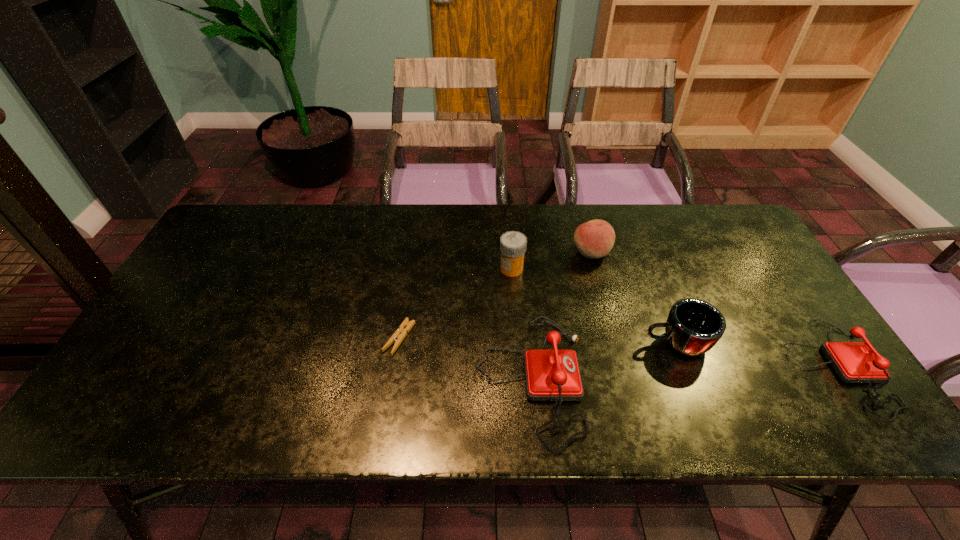
The width and height of the screenshot is (960, 540). Identify the location of vacant space located on the label side of the medicine. (482, 269).

Locate an element on the screen. The width and height of the screenshot is (960, 540). free location located on the label side of the medicine is located at coordinates (363, 269).

You are a GUI agent. You are given a task and a screenshot of the screen. Output one action in this format:
    pyautogui.click(x=<x>, y=<y>)
    Task: Click on the vacant area situated on the label side of the medicine
    This screenshot has height=540, width=960.
    Given the screenshot: What is the action you would take?
    pyautogui.click(x=451, y=269)

You are a GUI agent. You are given a task and a screenshot of the screen. Output one action in this format:
    pyautogui.click(x=<x>, y=<y>)
    Task: Click on the free spot located on the left of the shortest object
    
    Given the screenshot: What is the action you would take?
    pyautogui.click(x=299, y=338)

Where is `vacant space situated on the side of the mug with the handle`? Image resolution: width=960 pixels, height=540 pixels. vacant space situated on the side of the mug with the handle is located at coordinates (542, 343).

The image size is (960, 540). Find the location of `vacant point located 0.150m on the side of the mug with the handle`. vacant point located 0.150m on the side of the mug with the handle is located at coordinates (583, 343).

Find the location of a particular element. vacant region located on the side of the mug with the handle is located at coordinates (495, 343).

In order to click on object at the far edge in this screenshot , I will do click(x=594, y=239).

Locate an element on the screen. mug situated at the near edge is located at coordinates (693, 327).

Locate an element on the screen. object that is at the right edge is located at coordinates (855, 362).